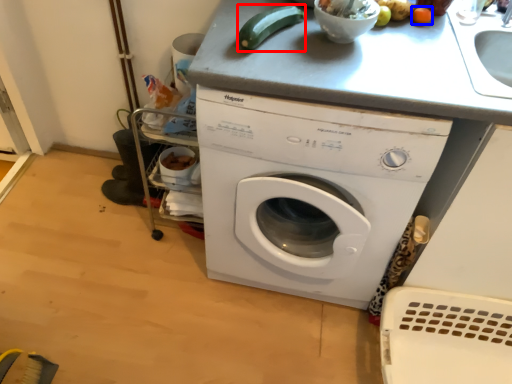
Question: Which of the following is the farthest to the observer, vegetable (highlighted by a red box) or vegetable (highlighted by a blue box)?

Choices:
 (A) vegetable
 (B) vegetable

Answer: (B)